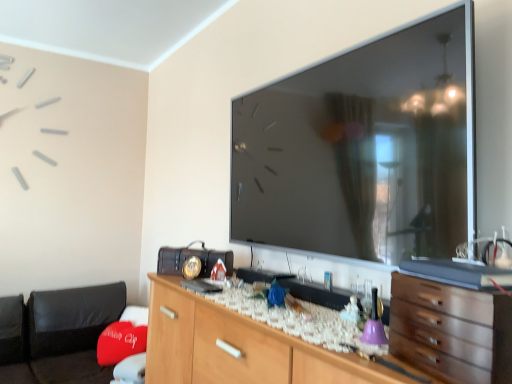
The width and height of the screenshot is (512, 384). I want to click on wooden cabinet at center, so coord(238,347).

Which of these two, red fabric bean bag at lower left or wooden cabinet at center, stands taller?

Standing taller between the two is red fabric bean bag at lower left.

From the image's perspective, is red fabric bean bag at lower left above or below wooden cabinet at center?

Clearly, from the image's perspective, red fabric bean bag at lower left is below wooden cabinet at center.

From a real-world perspective, between red fabric bean bag at lower left and wooden cabinet at center, who is vertically higher?

wooden cabinet at center, from a real-world perspective.

Is red fabric bean bag at lower left placed right next to wooden cabinet at center?

No.

From a real-world perspective, relative to red fabric bean bag at lower left, is metallic vintage radio at center vertically above or below?

In terms of real-world spatial position, metallic vintage radio at center is above red fabric bean bag at lower left.

Would you say metallic vintage radio at center is a long distance from red fabric bean bag at lower left?

Yes, metallic vintage radio at center is far from red fabric bean bag at lower left.

Which of these two, metallic vintage radio at center or red fabric bean bag at lower left, is bigger?

red fabric bean bag at lower left.

Looking at this image, from the image's perspective, is metallic vintage radio at center beneath red fabric bean bag at lower left?

Incorrect, from the image's perspective, metallic vintage radio at center is higher than red fabric bean bag at lower left.

Is point (17, 350) positioned in front of point (505, 304)?

No, it is behind (505, 304).

How different are the orientations of red fabric bean bag at lower left and wooden chest of drawers at lower right in degrees?

The angle between the facing direction of red fabric bean bag at lower left and the facing direction of wooden chest of drawers at lower right is 101 degrees.

Which is in front, red fabric bean bag at lower left or wooden chest of drawers at lower right?

Positioned in front is wooden chest of drawers at lower right.

Is red fabric bean bag at lower left with wooden chest of drawers at lower right?

They are not placed beside each other.

Is wooden cabinet at center wider than red fabric bean bag at lower left?

No.

Is wooden cabinet at center beside red fabric bean bag at lower left?

No, wooden cabinet at center is not touching red fabric bean bag at lower left.

Considering the sizes of objects wooden cabinet at center and red fabric bean bag at lower left in the image provided, who is bigger, wooden cabinet at center or red fabric bean bag at lower left?

With larger size is red fabric bean bag at lower left.

The height and width of the screenshot is (384, 512). What are the coordinates of `radio above the wooden cabinet at center (from the image's perspective)` in the screenshot? It's located at (190, 256).

In terms of height, does wooden cabinet at center look taller or shorter compared to metallic vintage radio at center?

In the image, wooden cabinet at center appears to be taller than metallic vintage radio at center.

Looking at this image, is metallic vintage radio at center a part of wooden cabinet at center?

No, metallic vintage radio at center is located outside of wooden cabinet at center.

Looking at this image, which object is closer to the camera taking this photo, wooden chest of drawers at lower right or wooden cabinet at center?

wooden chest of drawers at lower right.

From a real-world perspective, is wooden chest of drawers at lower right above or below wooden cabinet at center?

From a real-world perspective, wooden chest of drawers at lower right is physically above wooden cabinet at center.

Based on the photo, does metallic vintage radio at center lie behind wooden cabinet at center?

That is True.

From the image's perspective, which is above, metallic vintage radio at center or wooden cabinet at center?

metallic vintage radio at center is shown above in the image.

From a real-world perspective, which is physically below, metallic vintage radio at center or wooden cabinet at center?

wooden cabinet at center.

Could wooden cabinet at center be considered to be inside metallic vintage radio at center?

Actually, wooden cabinet at center is outside metallic vintage radio at center.

You are a GUI agent. You are given a task and a screenshot of the screen. Output one action in this format:
    pyautogui.click(x=<x>, y=<y>)
    Task: Click on the bean bag chair behind the wooden cabinet at center
    The width and height of the screenshot is (512, 384).
    Given the screenshot: What is the action you would take?
    pyautogui.click(x=59, y=334)

Identify the location of radio that appears above the red fabric bean bag at lower left (from the image's perspective). (190, 256).

Based on their spatial positions, is wooden cabinet at center or wooden chest of drawers at lower right further from red fabric bean bag at lower left?

Among the two, wooden chest of drawers at lower right is located further to red fabric bean bag at lower left.

Looking at this image, considering their positions, is metallic vintage radio at center positioned further to wooden cabinet at center than wooden chest of drawers at lower right?

Among the two, wooden chest of drawers at lower right is located further to wooden cabinet at center.

Based on their spatial positions, is wooden chest of drawers at lower right or red fabric bean bag at lower left closer to wooden cabinet at center?

wooden chest of drawers at lower right.

Based on their spatial positions, is red fabric bean bag at lower left or wooden chest of drawers at lower right closer to wooden cabinet at center?

Among the two, wooden chest of drawers at lower right is located nearer to wooden cabinet at center.

Estimate the real-world distances between objects in this image. Which object is closer to wooden cabinet at center, red fabric bean bag at lower left or metallic vintage radio at center?

Based on the image, metallic vintage radio at center appears to be nearer to wooden cabinet at center.

Estimate the real-world distances between objects in this image. Which object is further from red fabric bean bag at lower left, wooden chest of drawers at lower right or metallic vintage radio at center?

wooden chest of drawers at lower right.

From the image, which object appears to be nearer to metallic vintage radio at center, wooden cabinet at center or red fabric bean bag at lower left?

wooden cabinet at center lies closer to metallic vintage radio at center than the other object.

Considering their positions, is red fabric bean bag at lower left positioned further to metallic vintage radio at center than wooden chest of drawers at lower right?

The object further to metallic vintage radio at center is red fabric bean bag at lower left.

At what (x,y) coordinates should I click in order to perform the action: click on cabinetry situated between red fabric bean bag at lower left and wooden chest of drawers at lower right from left to right. Please return your answer as a coordinate pair (x, y). Looking at the image, I should click on (238, 347).

The width and height of the screenshot is (512, 384). Find the location of `cabinetry between wooden chest of drawers at lower right and metallic vintage radio at center in the front-back direction`. cabinetry between wooden chest of drawers at lower right and metallic vintage radio at center in the front-back direction is located at coordinates (238, 347).

The width and height of the screenshot is (512, 384). Find the location of `radio situated between red fabric bean bag at lower left and wooden chest of drawers at lower right from left to right`. radio situated between red fabric bean bag at lower left and wooden chest of drawers at lower right from left to right is located at coordinates (190, 256).

At what (x,y) coordinates should I click in order to perform the action: click on bean bag chair between wooden cabinet at center and metallic vintage radio at center in the front-back direction. Please return your answer as a coordinate pair (x, y). Looking at the image, I should click on (59, 334).